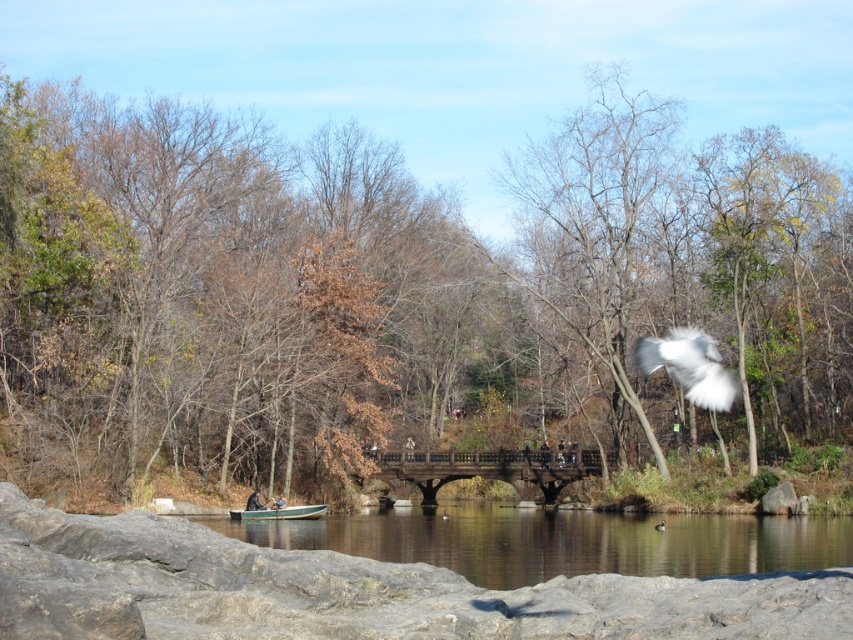
You are an ornithologist observing the scene. You notice the brown leafy tree at center and the white fluffy bird at upper right. Based on their positions, can you determine which object is closer to the observer?

The white fluffy bird at upper right is closer to the observer because it is positioned below the brown leafy tree at center, which suggests it is in a lower spatial plane and thus nearer in the visual field.